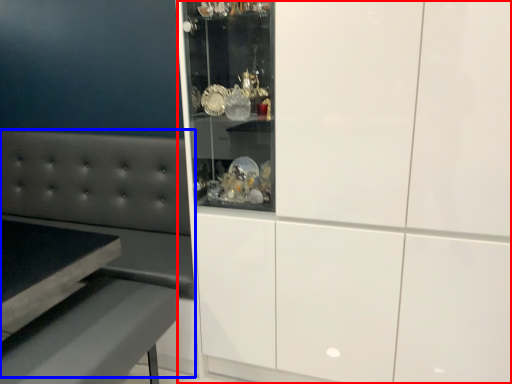
Question: Among these objects, which one is nearest to the camera, cabinetry (highlighted by a red box) or couch (highlighted by a blue box)?

Choices:
 (A) cabinetry
 (B) couch

Answer: (A)